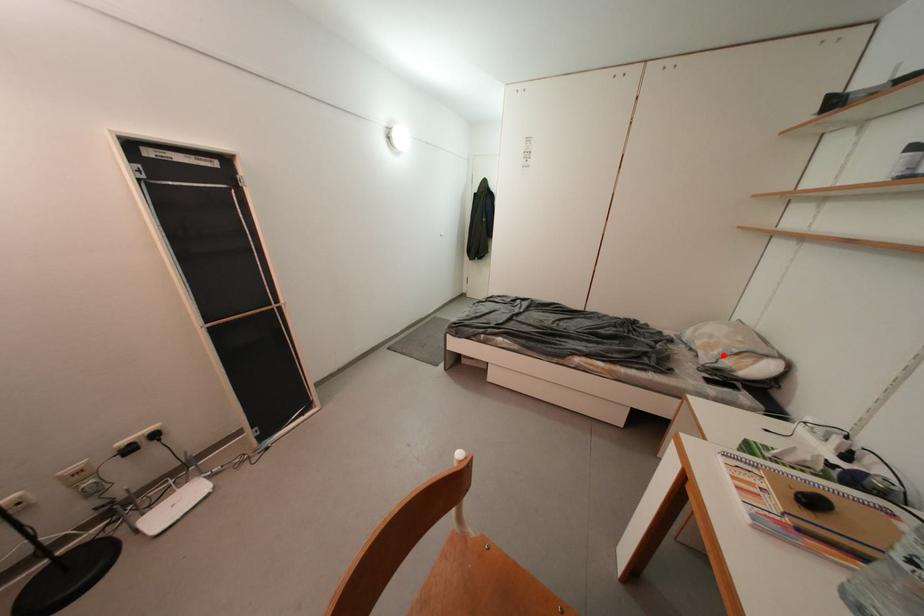
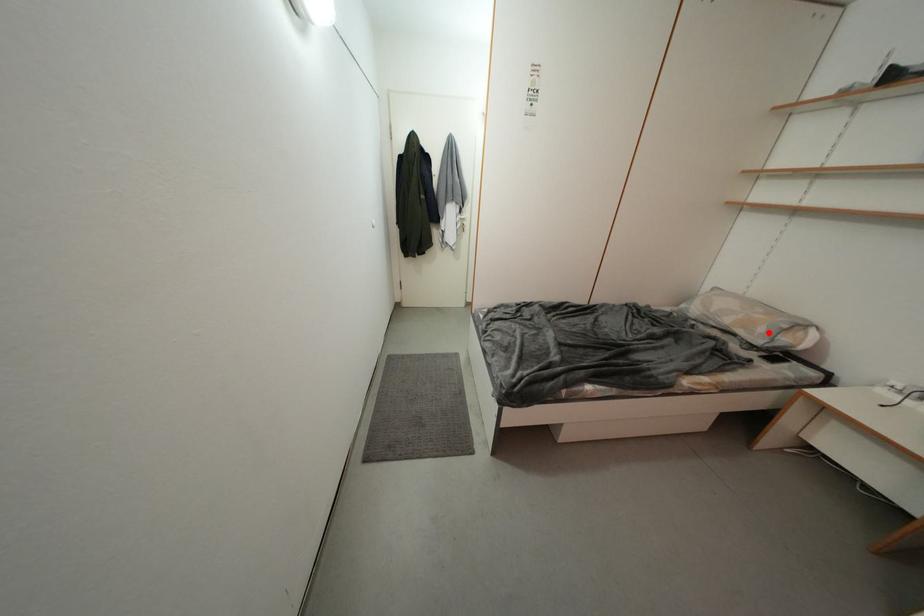
I am providing you with two images of the same scene from different viewpoints. A red point is marked on the first image and another point is marked on the second image. Do the highlighted points in image1 and image2 indicate the same real-world spot?

Yes